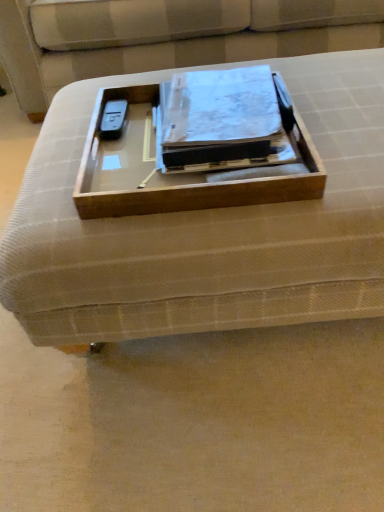
Where is `free point above wooden tray at center (from a real-world perspective)`? The width and height of the screenshot is (384, 512). free point above wooden tray at center (from a real-world perspective) is located at coordinates (218, 115).